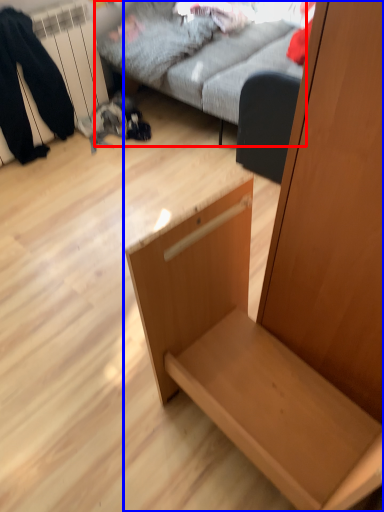
Question: Which object is further to the camera taking this photo, studio couch (highlighted by a red box) or furniture (highlighted by a blue box)?

Choices:
 (A) studio couch
 (B) furniture

Answer: (A)